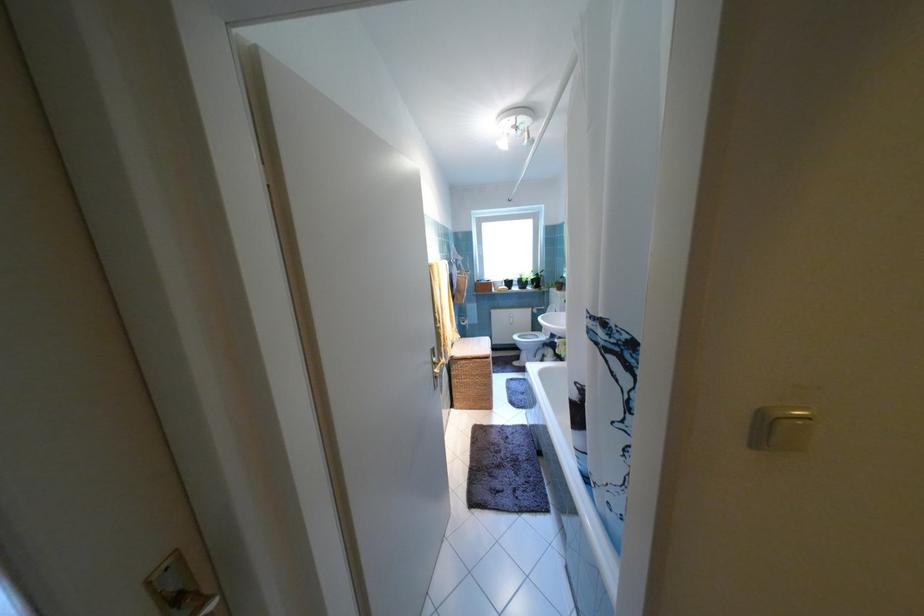
What do you see at coordinates (209, 605) in the screenshot?
I see `a silver door handle` at bounding box center [209, 605].